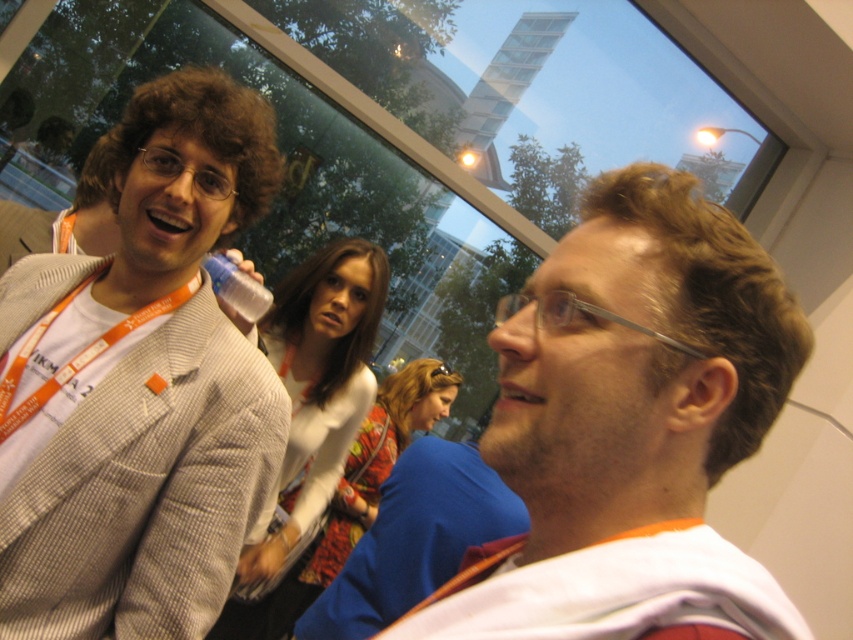
You are organizing a photo shoot and need to ensure that the two models, wearing the white sweater at center and the floral fabric dress at center, can stand side by side without overlapping. Given that the total available space is 1.5 meters wide, can both models fit comfortably if they stand 0.5 meters apart?

The white sweater at center has a width less than the floral fabric dress at center. However, without knowing the exact widths of each, it is impossible to determine if their combined width plus the 0.5 meters between them will fit within the 1.5 meter space. Additional measurements are needed.

You are organizing a photo shoot and need to ensure that the white sweater at center and floral fabric dress at center are both visible in the frame. Given their sizes, which one might require more careful positioning to avoid being cropped out?

The floral fabric dress at center requires more careful positioning because it occupies more space than the white sweater at center, making it more prone to being cropped out if not framed properly.